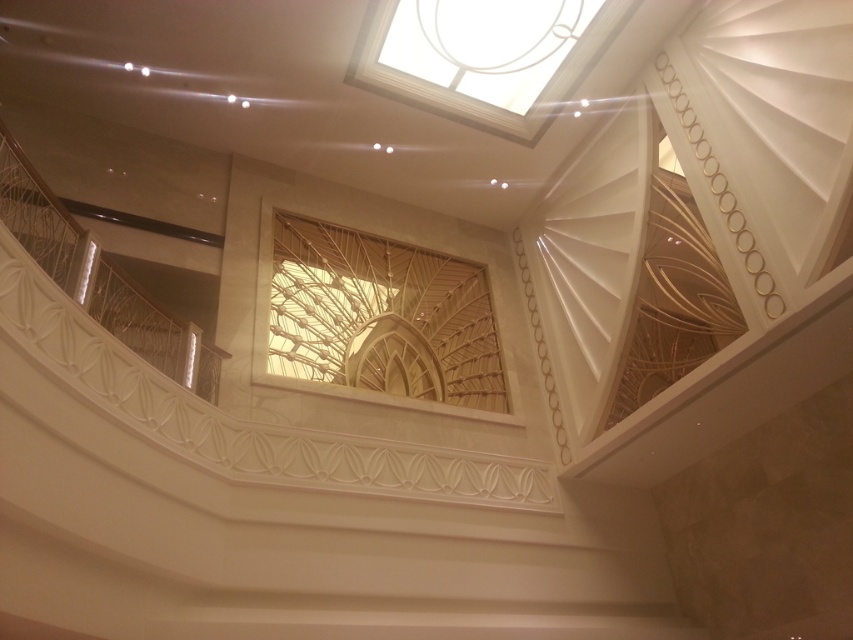
Does point (323, 344) lie in front of point (558, 61)?

Yes, it is.

Looking at this image, does translucent wood lattice at center have a greater width compared to transparent glass skylight at upper center?

In fact, translucent wood lattice at center might be narrower than transparent glass skylight at upper center.

This screenshot has height=640, width=853. I want to click on translucent wood lattice at center, so click(381, 316).